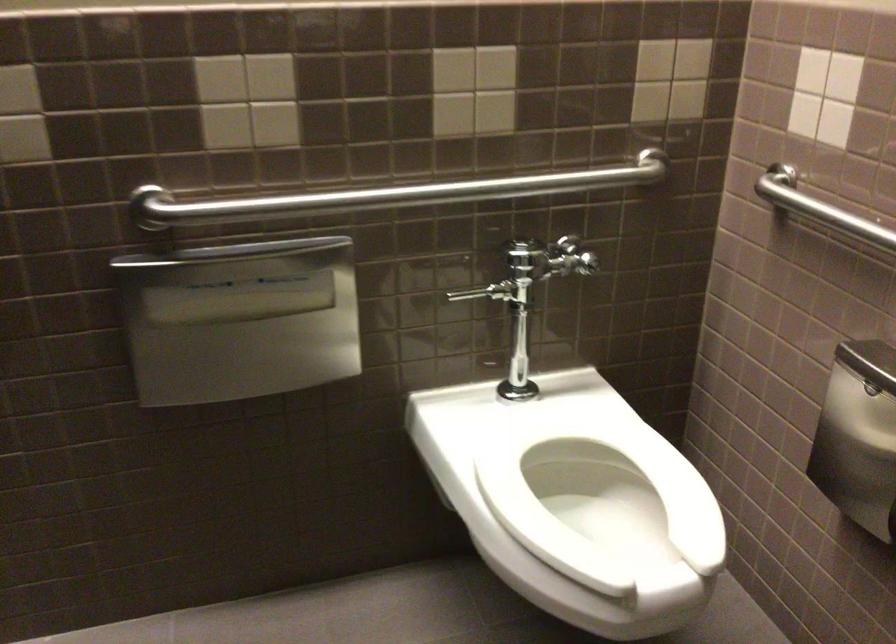
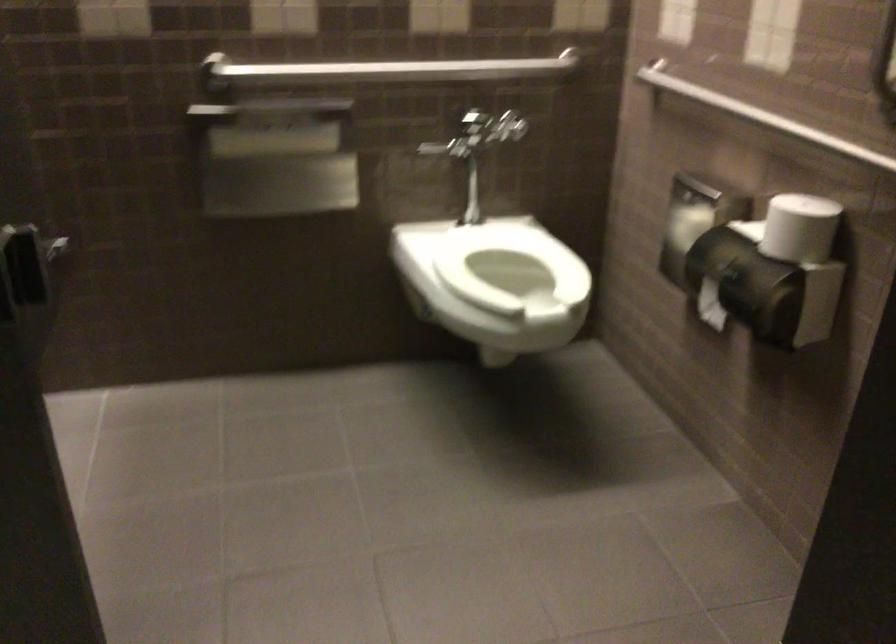
In the second image, find the point that corresponds to [578,455] in the first image.

(509, 263)